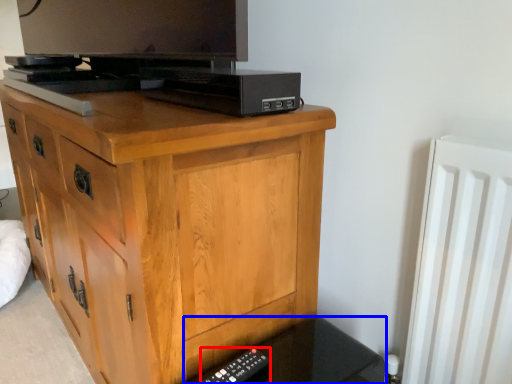
Question: Among these objects, which one is nearest to the camera, remote (highlighted by a red box) or vanity (highlighted by a blue box)?

Choices:
 (A) remote
 (B) vanity

Answer: (B)